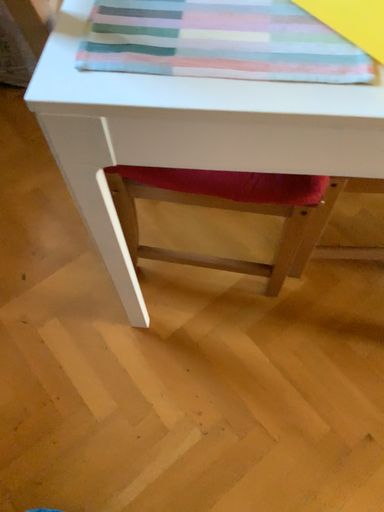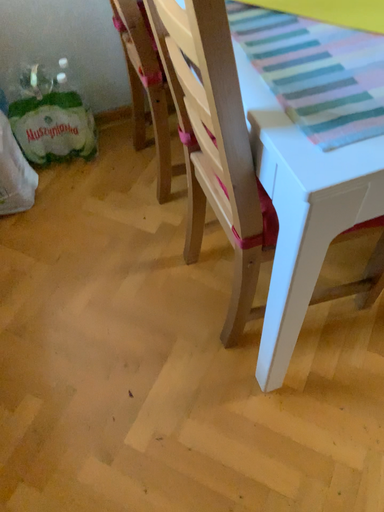
Question: Which way did the camera rotate in the video?

Choices:
 (A) rotated upward
 (B) rotated downward

Answer: (A)